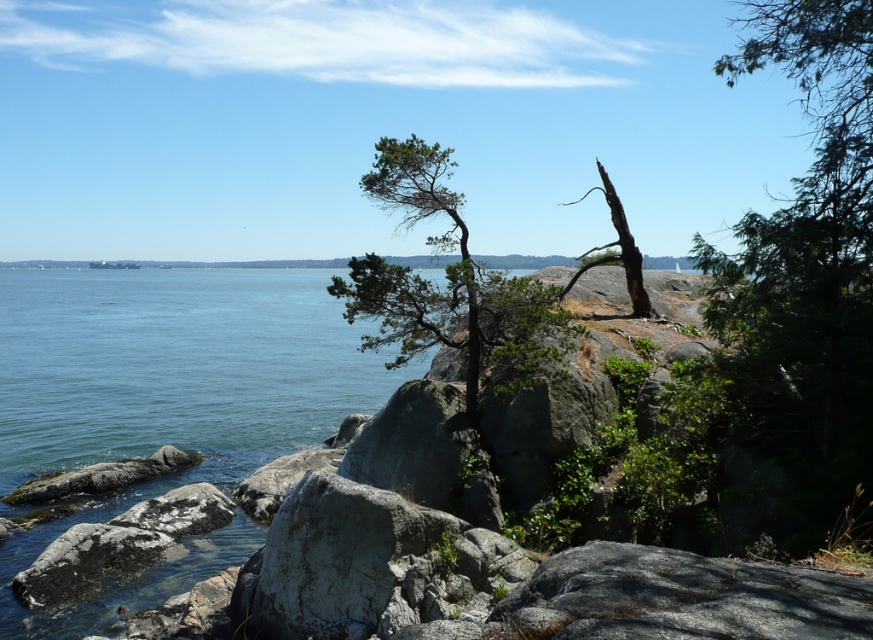
Question: Is green textured tree at center to the right of bare wood tree at center from the viewer's perspective?

Choices:
 (A) no
 (B) yes

Answer: (A)

Question: Which object is closer to the camera taking this photo?

Choices:
 (A) bare wood tree at center
 (B) green textured tree at center

Answer: (B)

Question: Which of the following is the farthest from the observer?

Choices:
 (A) (459, 212)
 (B) (631, 257)

Answer: (B)

Question: Observing the image, what is the correct spatial positioning of green textured tree at center in reference to bare wood tree at center?

Choices:
 (A) left
 (B) right

Answer: (A)

Question: Is green textured tree at center bigger than bare wood tree at center?

Choices:
 (A) no
 (B) yes

Answer: (A)